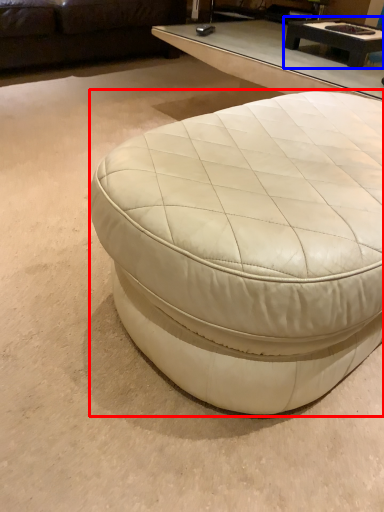
Question: Which point is closer to the camera, coffee table (highlighted by a red box) or coffee table (highlighted by a blue box)?

Choices:
 (A) coffee table
 (B) coffee table

Answer: (A)